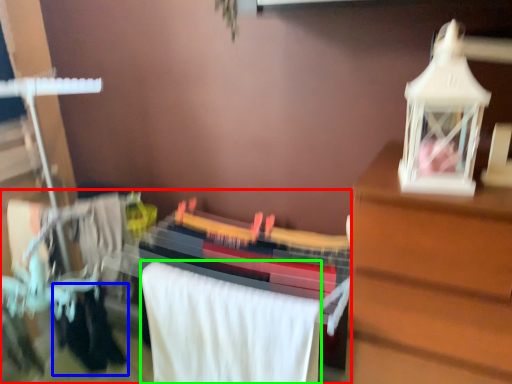
Question: Estimate the real-world distances between objects in this image. Which object is farther from closet (highlighted by a red box), clothing (highlighted by a blue box) or bath towel (highlighted by a green box)?

Choices:
 (A) clothing
 (B) bath towel

Answer: (A)